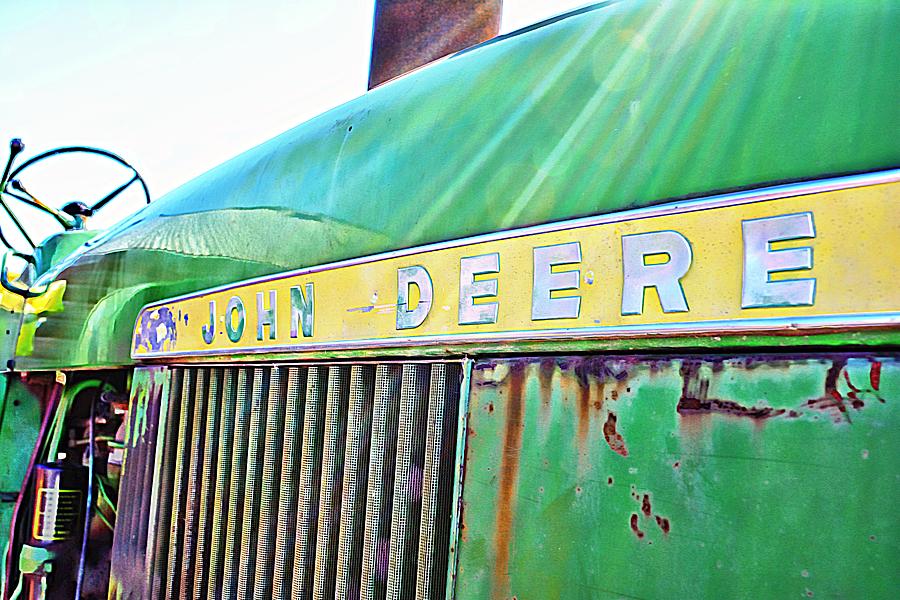
Where is `cables and wires`? cables and wires is located at coordinates (40, 433), (54, 435), (59, 442), (92, 454), (108, 506).